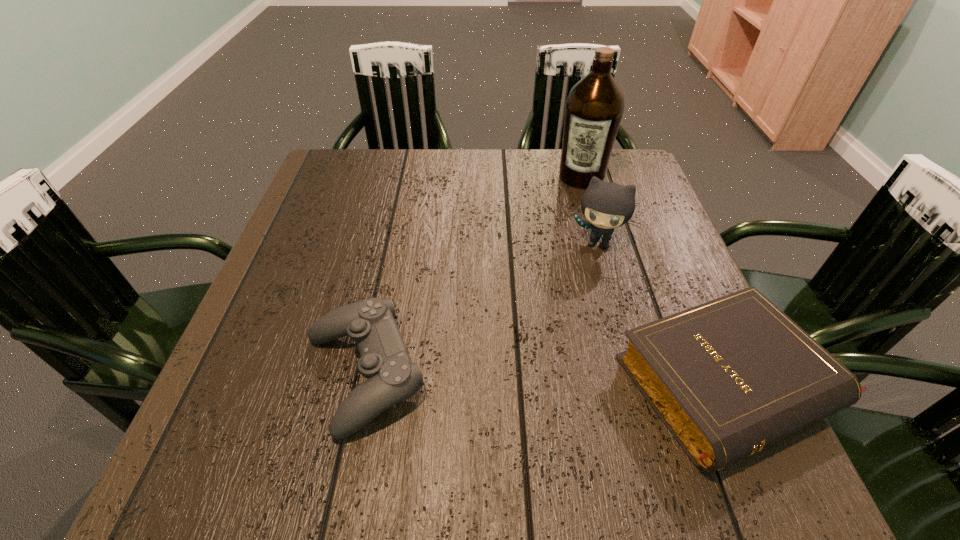
Where is `free space located on the label of the farthest object`? The width and height of the screenshot is (960, 540). free space located on the label of the farthest object is located at coordinates (564, 230).

The width and height of the screenshot is (960, 540). I want to click on blank space located 0.320m on the front-facing side of the kitten, so click(x=546, y=369).

At what (x,y) coordinates should I click in order to perform the action: click on vacant region located on the front-facing side of the kitten. Please return your answer as a coordinate pair (x, y). Looking at the image, I should click on (561, 327).

You are a GUI agent. You are given a task and a screenshot of the screen. Output one action in this format:
    pyautogui.click(x=<x>, y=<y>)
    Task: Click on the vacant point located on the front-facing side of the kitten
    
    Given the screenshot: What is the action you would take?
    coord(548,364)

Image resolution: width=960 pixels, height=540 pixels. I want to click on object that is at the far edge, so click(x=594, y=108).

Locate an element on the screen. control that is positioned at the near edge is located at coordinates (391, 376).

The width and height of the screenshot is (960, 540). Find the location of `Bible present at the near edge`. Bible present at the near edge is located at coordinates (729, 377).

Where is `object that is at the left edge`? object that is at the left edge is located at coordinates (391, 376).

What are the coordinates of `Bible positioned at the right edge` in the screenshot? It's located at (729, 377).

At what (x,y) coordinates should I click in order to perform the action: click on olive oil that is at the right edge. Please return your answer as a coordinate pair (x, y). The height and width of the screenshot is (540, 960). Looking at the image, I should click on (594, 108).